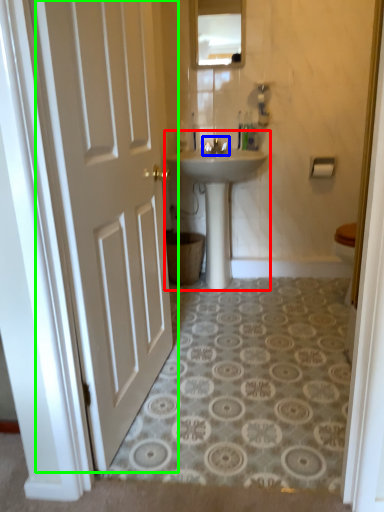
Question: Based on their relative distances, which object is farther from sink (highlighted by a red box)? Choose from tap (highlighted by a blue box) and door (highlighted by a green box).

Choices:
 (A) tap
 (B) door

Answer: (B)